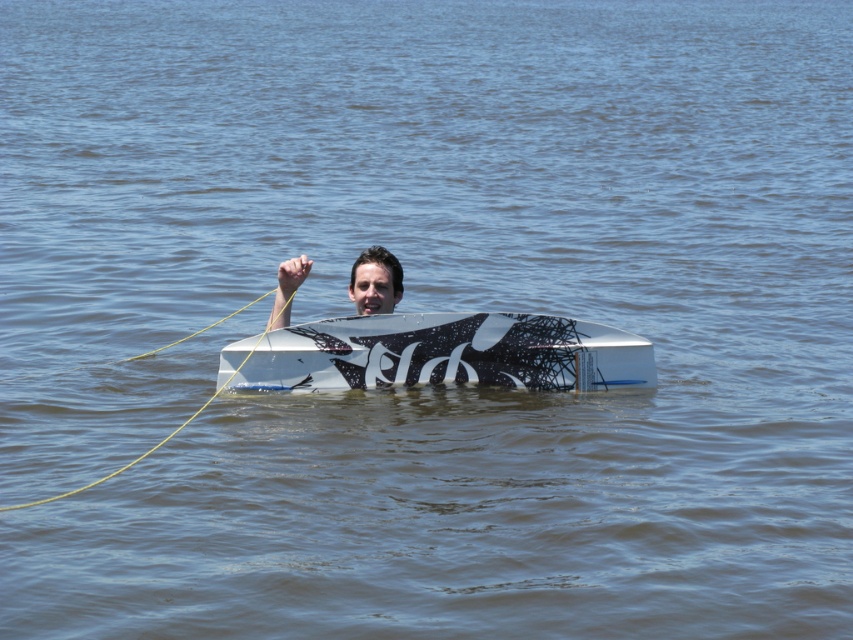
Which of these two, white matte surfboard at center or matte black surfboard at center, stands taller?

With more height is white matte surfboard at center.

Based on the photo, can you confirm if white matte surfboard at center is smaller than matte black surfboard at center?

Actually, white matte surfboard at center might be larger than matte black surfboard at center.

Does point (502, 332) come closer to viewer compared to point (378, 266)?

Yes, it is in front of point (378, 266).

Locate an element on the screen. white matte surfboard at center is located at coordinates (440, 353).